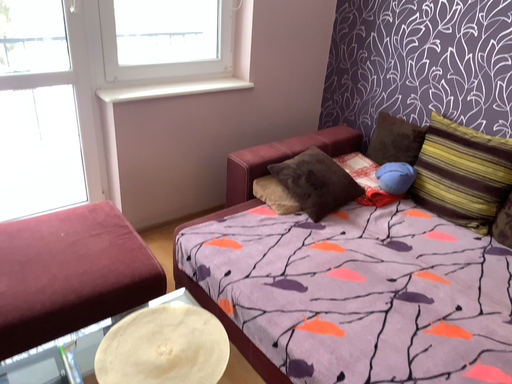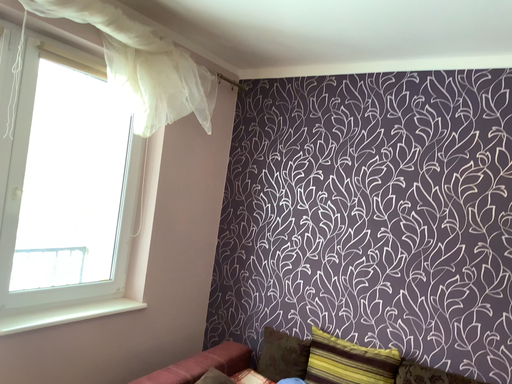
Question: How did the camera likely rotate when shooting the video?

Choices:
 (A) rotated upward
 (B) rotated downward

Answer: (A)